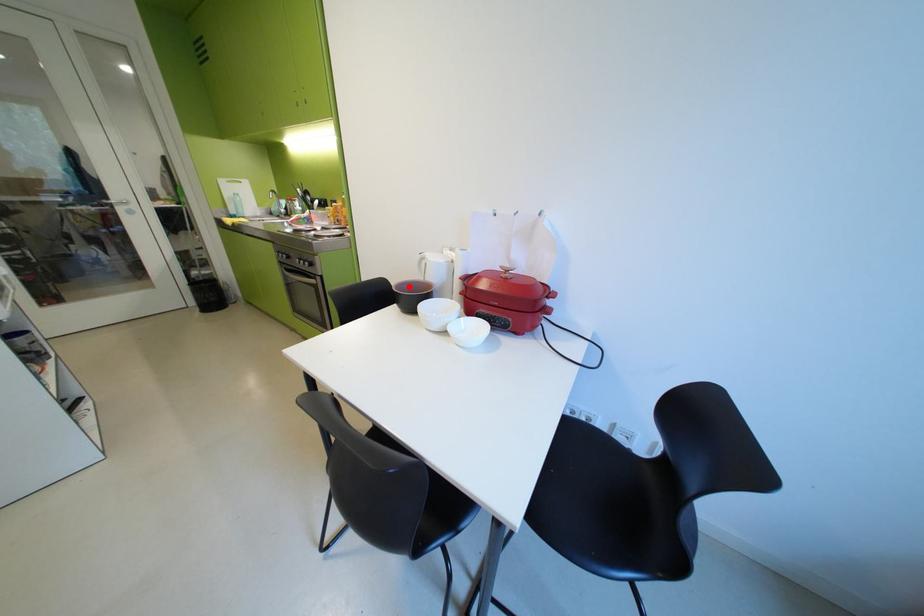
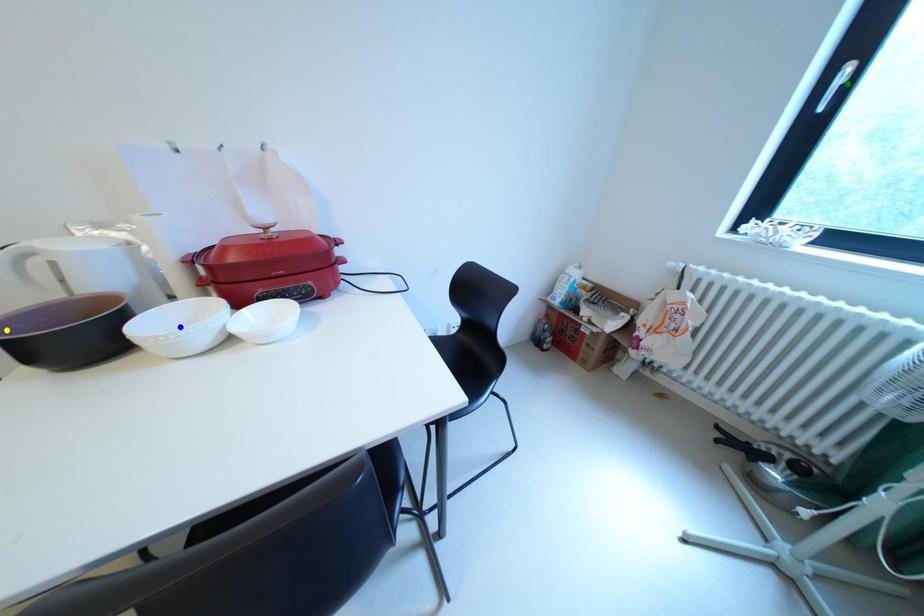
Question: I am providing you with two images of the same scene from different viewpoints. A red point is marked on the first image. You are given multiple points on the second image. Which point in image 2 represents the same 3d spot as the red point in image 1?

Choices:
 (A) blue point
 (B) yellow point
 (C) green point

Answer: (B)